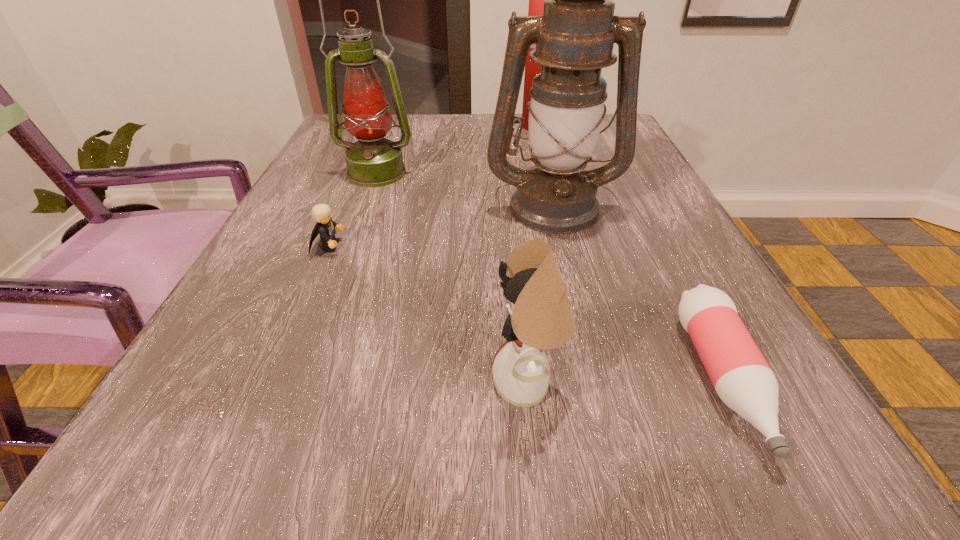
The width and height of the screenshot is (960, 540). Identify the location of free space located 0.180m on the back of the left oil lamp. (394, 128).

The width and height of the screenshot is (960, 540). What are the coordinates of `vacant space located at the front face of the third shortest object` in the screenshot? It's located at (347, 383).

Locate an element on the screen. Image resolution: width=960 pixels, height=540 pixels. vacant space located 0.350m at the front face of the third shortest object is located at coordinates (208, 383).

Find the location of a particular element. vacant space located 0.110m at the front face of the third shortest object is located at coordinates (403, 383).

At what (x,y) coordinates should I click in order to perform the action: click on free space located 0.220m on the front-facing side of the second shortest object. Please return your answer as a coordinate pair (x, y). Image resolution: width=960 pixels, height=540 pixels. Looking at the image, I should click on (472, 247).

Where is `object that is at the far edge`? object that is at the far edge is located at coordinates (536, 0).

You are a GUI agent. You are given a task and a screenshot of the screen. Output one action in this format:
    pyautogui.click(x=<x>, y=<y>)
    Task: Click on the doll present at the near edge
    
    Given the screenshot: What is the action you would take?
    pyautogui.click(x=542, y=319)

This screenshot has width=960, height=540. I want to click on bottle that is positioned at the near edge, so click(x=741, y=376).

Where is `oil lamp that is at the left edge`? Image resolution: width=960 pixels, height=540 pixels. oil lamp that is at the left edge is located at coordinates (373, 161).

I want to click on Lego at the left edge, so click(x=325, y=227).